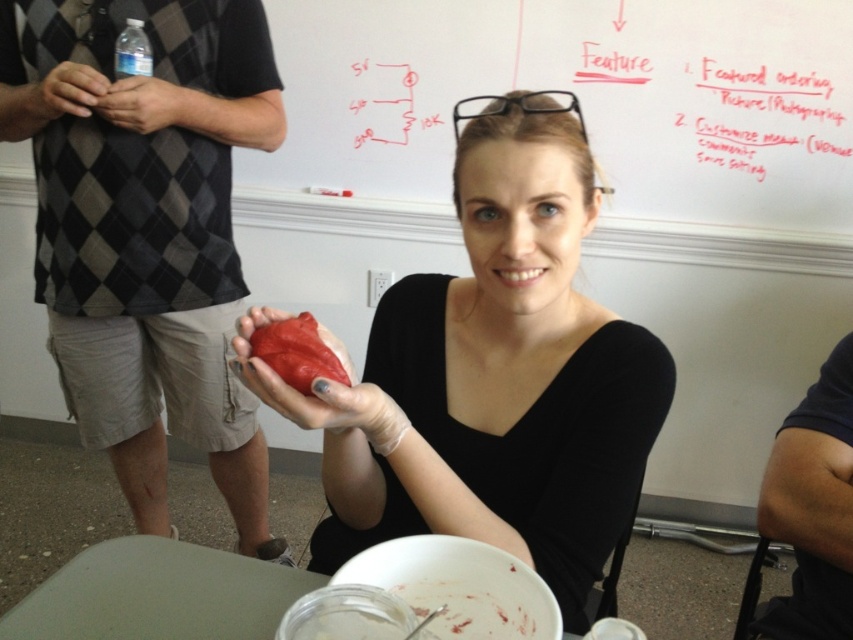
You are organizing a science fair booth and need to arrange two items on a table. You have a white paper at upper center and a matte plastic food at lower center. Which item should you place higher up to ensure visibility?

The white paper at upper center should be placed higher up because it is larger in size than the matte plastic food at lower center, making it more visible from a distance.

You are standing in the workshop and looking at the whiteboard. There are two points marked on the whiteboard at coordinates point [283,580] and point [444,628]. Which point is closer to you?

Point [283,580] is further to the camera than point [444,628], so the point closer to you is point [444,628].

You are a student in the classroom and want to see both the white paper at upper center and the matte plastic food at lower center. Which object would you need to move closer to you to view better?

The matte plastic food at lower center is behind the white paper at upper center, so you would need to move the white paper at upper center closer to you to view both objects better.